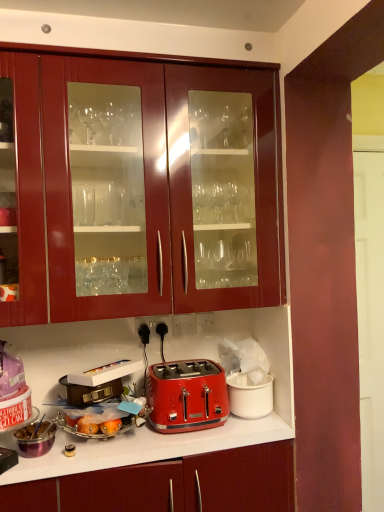
At what (x,y) coordinates should I click in order to perform the action: click on free point above brown leather suitcase at lower left, which is the 2th appliance in right-to-left order (from a real-world perspective). Please return your answer as a coordinate pair (x, y). Looking at the image, I should click on (89, 382).